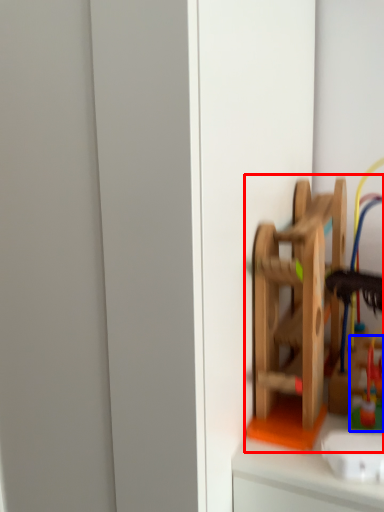
Question: Which point is closer to the camera, toy (highlighted by a red box) or toy (highlighted by a blue box)?

Choices:
 (A) toy
 (B) toy

Answer: (A)